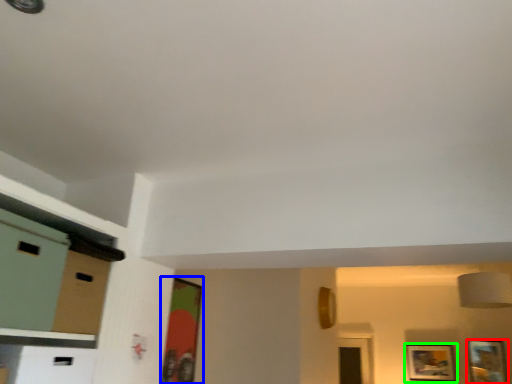
Question: Which object is positioned farthest from picture frame (highlighted by a red box)? Select from picture frame (highlighted by a blue box) and picture frame (highlighted by a green box).

Choices:
 (A) picture frame
 (B) picture frame

Answer: (A)